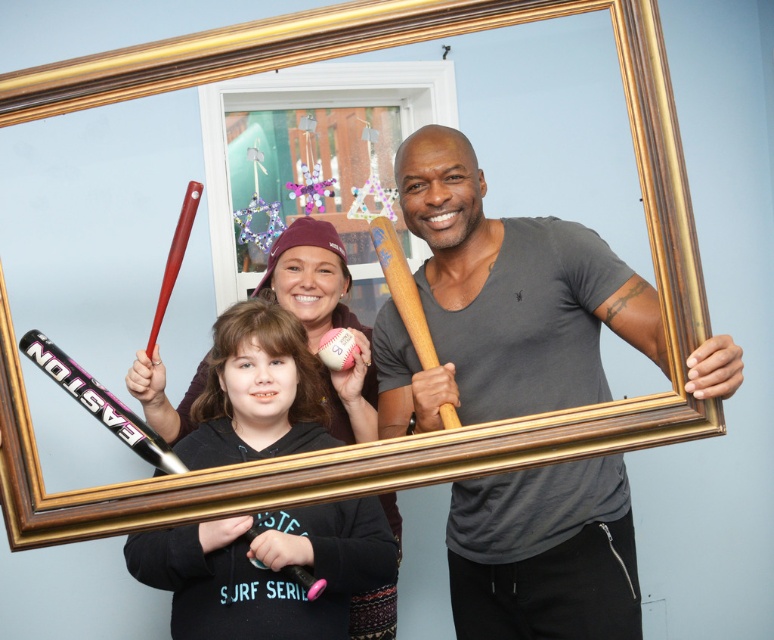
Question: Is matte gray t-shirt at center thinner than pink matte baseball bat at center?

Choices:
 (A) no
 (B) yes

Answer: (A)

Question: Does pink matte baseball bat at center have a lesser width compared to matte red baseball bat at upper left?

Choices:
 (A) no
 (B) yes

Answer: (A)

Question: Which object appears closest to the camera in this image?

Choices:
 (A) matte red baseball bat at upper left
 (B) matte gray t-shirt at center
 (C) wooden baseball bat at center
 (D) pink matte baseball bat at center

Answer: (B)

Question: Is matte gray t-shirt at center wider than matte red baseball bat at upper left?

Choices:
 (A) no
 (B) yes

Answer: (B)

Question: Which of the following is the closest to the observer?

Choices:
 (A) (300, 554)
 (B) (185, 209)
 (C) (392, 253)

Answer: (A)

Question: Considering the real-world distances, which object is closest to the matte red baseball bat at upper left?

Choices:
 (A) wooden baseball bat at center
 (B) pink matte baseball bat at center
 (C) matte gray t-shirt at center

Answer: (B)